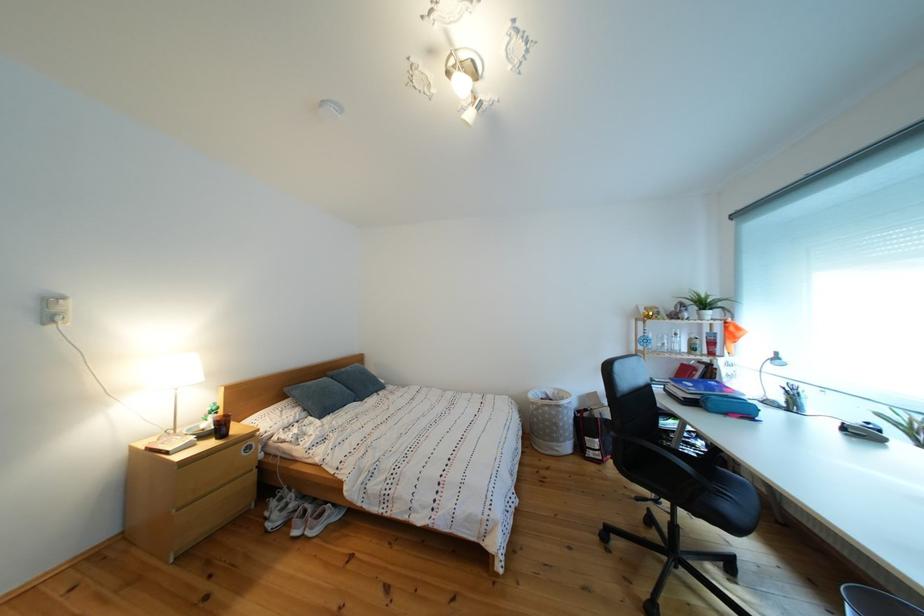
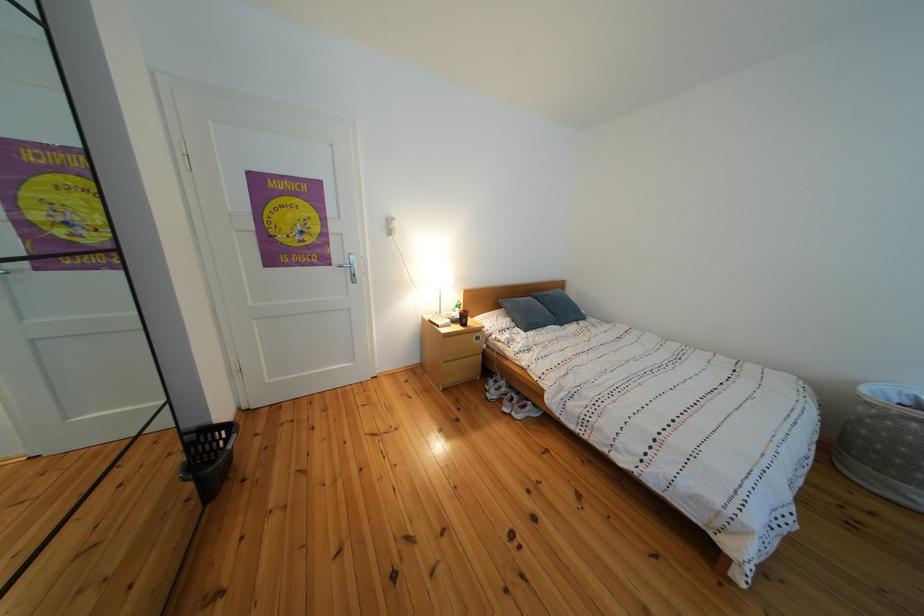
Locate, in the second image, the point that corresponds to point (195, 436) in the first image.

(456, 320)